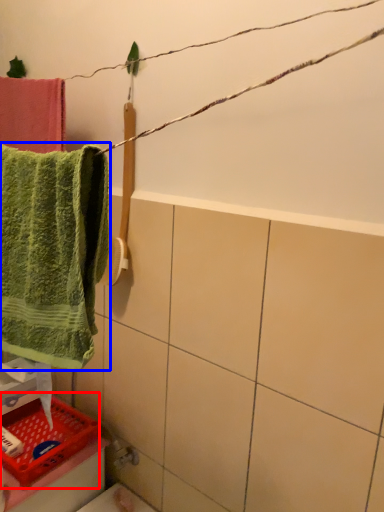
Question: Which point is further to the camera, basket (highlighted by a red box) or towel (highlighted by a blue box)?

Choices:
 (A) basket
 (B) towel

Answer: (A)